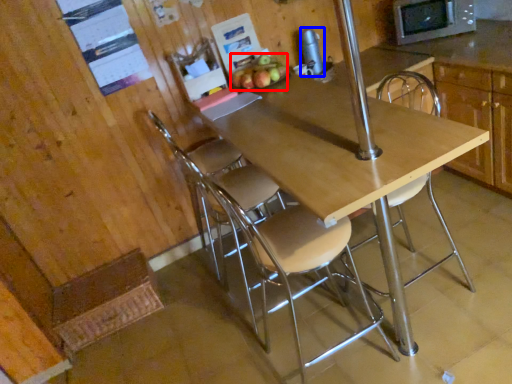
Question: Which of the following is the farthest to the observer, apple (highlighted by a red box) or appliance (highlighted by a blue box)?

Choices:
 (A) apple
 (B) appliance

Answer: (B)